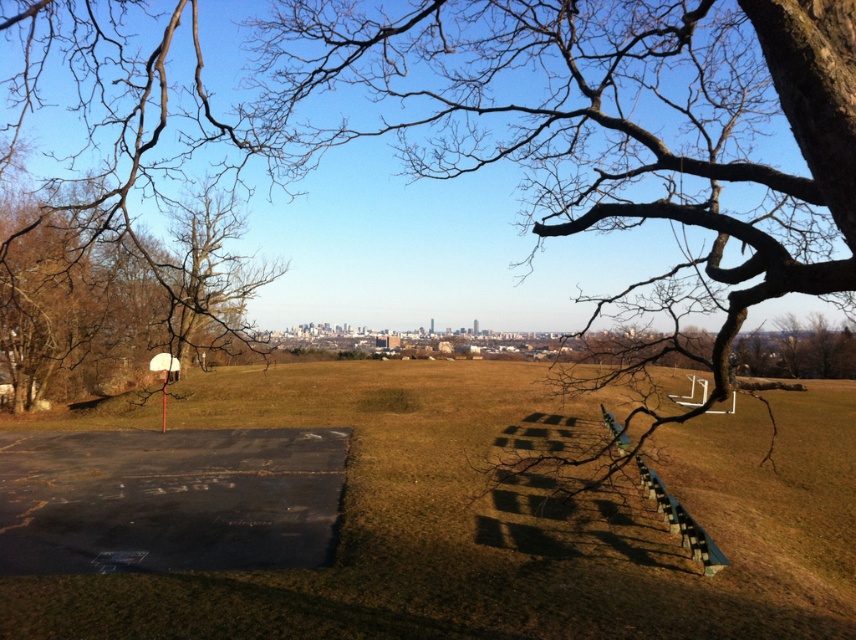
In the scene shown: You are standing in the middle of the green grass at center and want to throw a ball towards the basketball hoop on the left. Which direction should you aim to ensure the ball passes under the brown bark tree at left?

The green grass at center is located below the brown bark tree at left, so you should aim to throw the ball towards the basketball hoop on the left while keeping the trajectory low to pass under the brown bark tree at left.